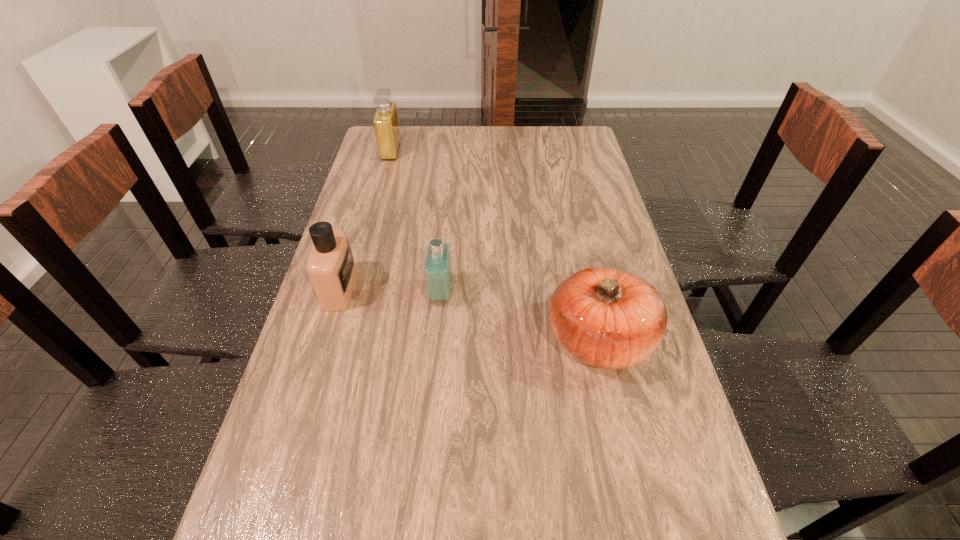
In the image, there is a desktop. What are the coordinates of `vacant space at the far edge` in the screenshot? It's located at (524, 149).

Where is `vacant region at the left edge of the desktop`? vacant region at the left edge of the desktop is located at coordinates (258, 517).

The height and width of the screenshot is (540, 960). In the image, there is a desktop. Identify the location of free space at the right edge. (596, 228).

Image resolution: width=960 pixels, height=540 pixels. Find the location of `vacant position at the far left corner of the desktop`. vacant position at the far left corner of the desktop is located at coordinates (405, 140).

In the image, there is a desktop. In order to click on free region at the far right corner in this screenshot , I will do `click(564, 130)`.

At what (x,y) coordinates should I click in order to perform the action: click on free space between the farthest perfume and the pumpkin. Please return your answer as a coordinate pair (x, y). Looking at the image, I should click on (495, 245).

You are a GUI agent. You are given a task and a screenshot of the screen. Output one action in this format:
    pyautogui.click(x=<x>, y=<y>)
    Task: Click on the empty location between the shortest perfume and the farthest perfume
    This screenshot has width=960, height=540.
    Given the screenshot: What is the action you would take?
    pyautogui.click(x=416, y=222)

This screenshot has height=540, width=960. I want to click on free space between the rightmost object and the rightmost perfume, so click(520, 316).

Identify the location of free space between the shortest perfume and the rightmost object. The image size is (960, 540). [x=520, y=316].

This screenshot has width=960, height=540. What are the coordinates of `vacant space in between the rightmost object and the farthest object` in the screenshot? It's located at (495, 245).